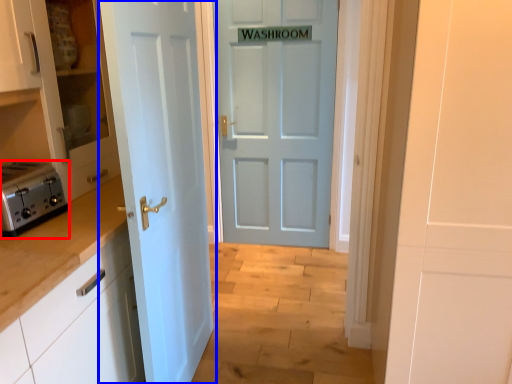
Question: Among these objects, which one is farthest to the camera, toaster (highlighted by a red box) or door (highlighted by a blue box)?

Choices:
 (A) toaster
 (B) door

Answer: (A)